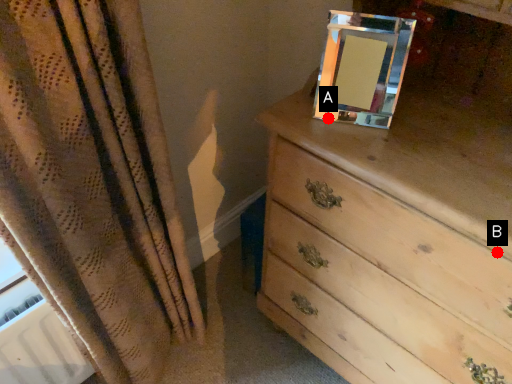
Question: Two points are circled on the image, labeled by A and B beside each circle. Which point is farther from the camera taking this photo?

Choices:
 (A) A is further
 (B) B is further

Answer: (A)